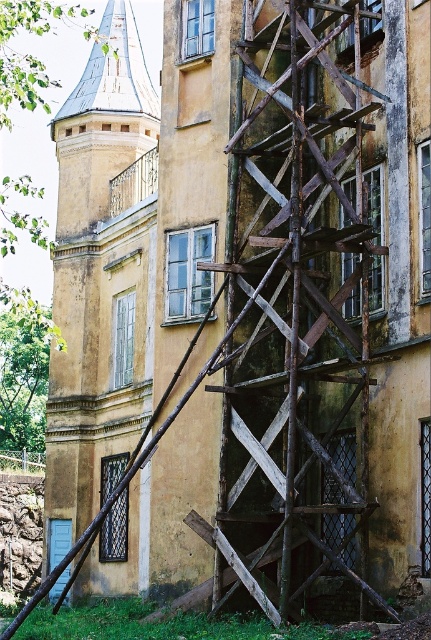
Can you confirm if rusty wood scaffolding at center is taller than matte yellow tower at center?

In fact, rusty wood scaffolding at center may be shorter than matte yellow tower at center.

Does rusty wood scaffolding at center have a smaller size compared to matte yellow tower at center?

Indeed, rusty wood scaffolding at center has a smaller size compared to matte yellow tower at center.

This screenshot has width=431, height=640. I want to click on rusty wood scaffolding at center, so click(297, 310).